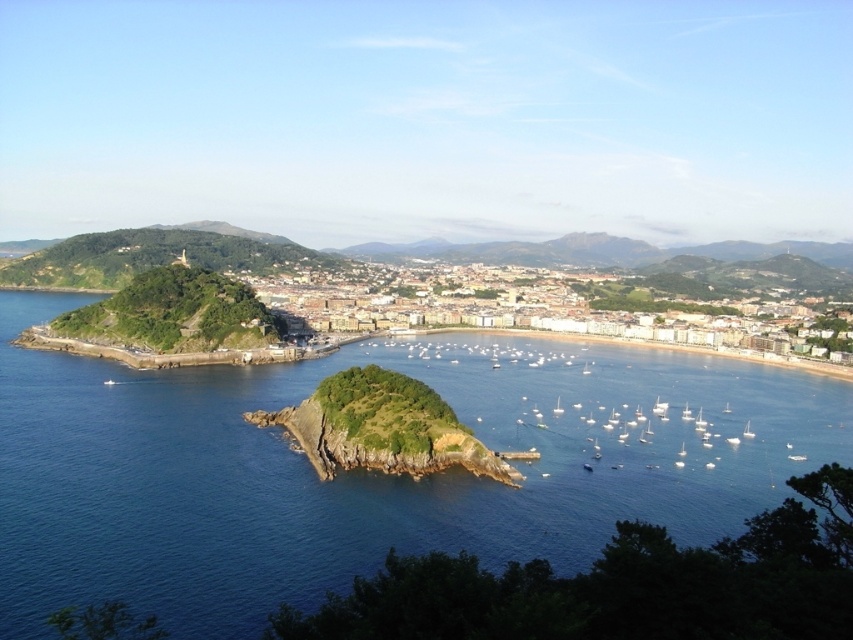
Can you confirm if blue water at center is shorter than green grassy hillside at center?

Yes.

Which is below, blue water at center or green grassy hillside at center?

blue water at center is below.

Find the location of a particular element. The width and height of the screenshot is (853, 640). blue water at center is located at coordinates point(363,470).

Image resolution: width=853 pixels, height=640 pixels. Find the location of `blue water at center`. blue water at center is located at coordinates (363, 470).